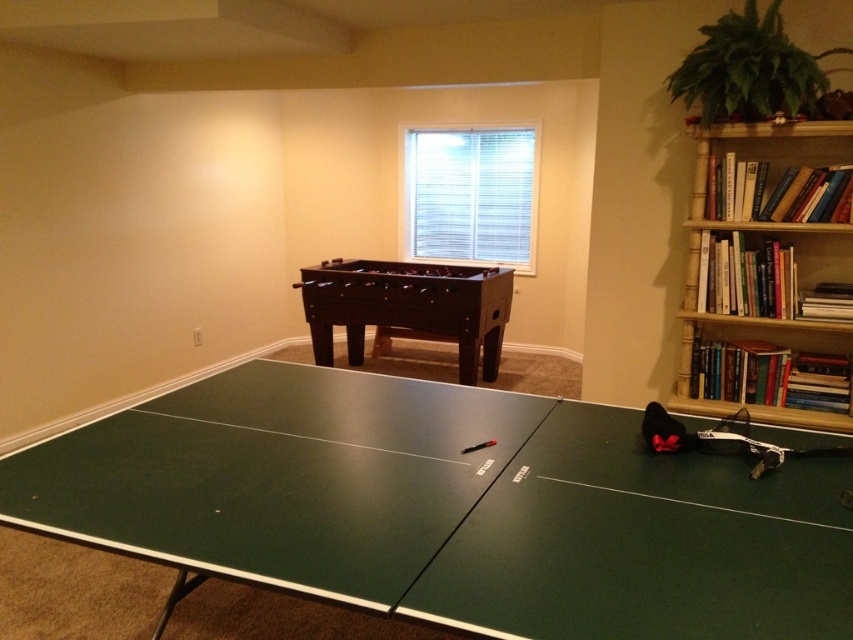
Question: Which point is farther to the camera?

Choices:
 (A) green matte ping pong table at center
 (B) dark brown wooden foosball table at center

Answer: (B)

Question: Can you confirm if wooden bookshelf at right is wider than dark brown wooden foosball table at center?

Choices:
 (A) yes
 (B) no

Answer: (B)

Question: Considering the real-world distances, which object is farthest from the wooden bookshelf at right?

Choices:
 (A) dark brown wooden foosball table at center
 (B) green matte ping pong table at center

Answer: (A)

Question: Is green matte ping pong table at center bigger than dark brown wooden foosball table at center?

Choices:
 (A) no
 (B) yes

Answer: (B)

Question: Among these objects, which one is farthest from the camera?

Choices:
 (A) wooden bookshelf at right
 (B) dark brown wooden foosball table at center

Answer: (B)

Question: Is wooden bookshelf at right below dark brown wooden foosball table at center?

Choices:
 (A) no
 (B) yes

Answer: (A)